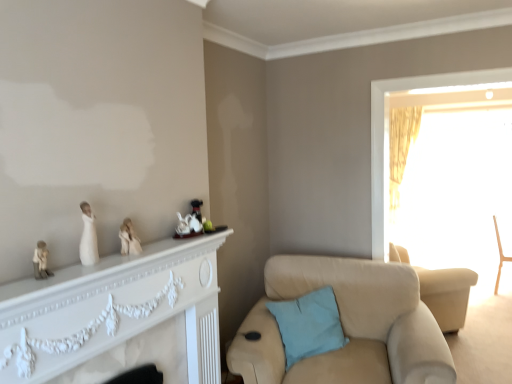
Question: Is matte black teapot at center, positioned as the first toy in back-to-front order, bigger or smaller than white porcelain teapot at center, which ranks as the 2th toy in left-to-right order?

Choices:
 (A) big
 (B) small

Answer: (B)

Question: Considering their positions, is matte black teapot at center, positioned as the first toy in right-to-left order, located in front of or behind white porcelain teapot at center, marked as the 2th toy in a right-to-left arrangement?

Choices:
 (A) front
 (B) behind

Answer: (B)

Question: Which object is positioned closest to the white matte figurine at left, which appears as the third toy when viewed from the right?

Choices:
 (A) white porcelain figurine at center, placed as the 1th person when sorted from back to front
 (B) light blue fabric pillow at lower center
 (C) wooden chair at right, positioned as the 2th chair in left-to-right order
 (D) matte black teapot at center, placed as the 3th toy when sorted from front to back
 (E) white porcelain figurine at left, placed as the first person when sorted from front to back

Answer: (E)

Question: Which is nearer to the white porcelain figurine at left, which appears as the first person when viewed from the left?

Choices:
 (A) white porcelain teapot at center, which ranks as the second toy in front-to-back order
 (B) white porcelain figurine at center, marked as the 1th person in a right-to-left arrangement
 (C) gold textured curtain at right
 (D) matte black teapot at center, placed as the 3th toy when sorted from front to back
 (E) translucent yellow curtain at right

Answer: (B)